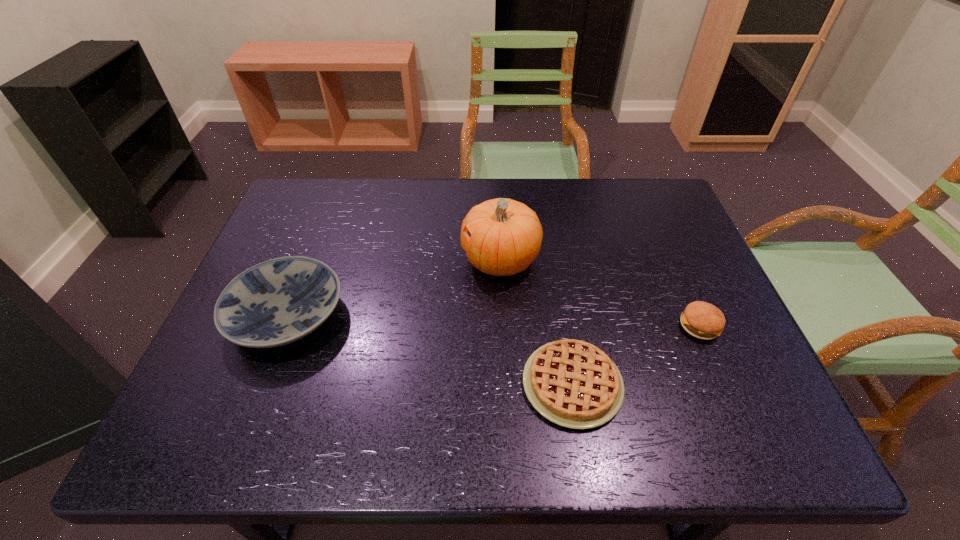
Identify which object is the third nearest to the pie. Please provide its 2D coordinates. Your answer should be formatted as a tuple, i.e. [(x, y)], where the tuple contains the x and y coordinates of a point satisfying the conditions above.

[(274, 303)]

Locate an element on the screen. This screenshot has height=540, width=960. the third closest object to the rightmost object is located at coordinates (274, 303).

This screenshot has width=960, height=540. What are the coordinates of `vacant space that satisfies the following two spatial constraints: 1. on the front-facing side of the pumpkin; 2. on the left side of the pie` in the screenshot? It's located at (507, 384).

Identify the location of free space that satisfies the following two spatial constraints: 1. on the front-facing side of the pumpkin; 2. on the front side of the leftmost object. (503, 316).

Locate an element on the screen. free location that satisfies the following two spatial constraints: 1. on the back side of the hamburger; 2. on the front-facing side of the tallest object is located at coordinates (670, 260).

The height and width of the screenshot is (540, 960). Find the location of `vacant space that satisfies the following two spatial constraints: 1. on the front-facing side of the pumpkin; 2. on the right side of the shortest object`. vacant space that satisfies the following two spatial constraints: 1. on the front-facing side of the pumpkin; 2. on the right side of the shortest object is located at coordinates (507, 384).

Identify the location of free space that satisfies the following two spatial constraints: 1. on the front-facing side of the tallest object; 2. on the right side of the rightmost object. The height and width of the screenshot is (540, 960). (504, 326).

Find the location of a particular element. The height and width of the screenshot is (540, 960). free point that satisfies the following two spatial constraints: 1. on the front-facing side of the pumpkin; 2. on the right side of the third tallest object is located at coordinates point(504,326).

You are a GUI agent. You are given a task and a screenshot of the screen. Output one action in this format:
    pyautogui.click(x=<x>, y=<y>)
    Task: Click on the free region that satisfies the following two spatial constraints: 1. on the front-facing side of the shortest object; 2. on the right side of the pumpkin
    The height and width of the screenshot is (540, 960).
    Given the screenshot: What is the action you would take?
    pyautogui.click(x=507, y=384)